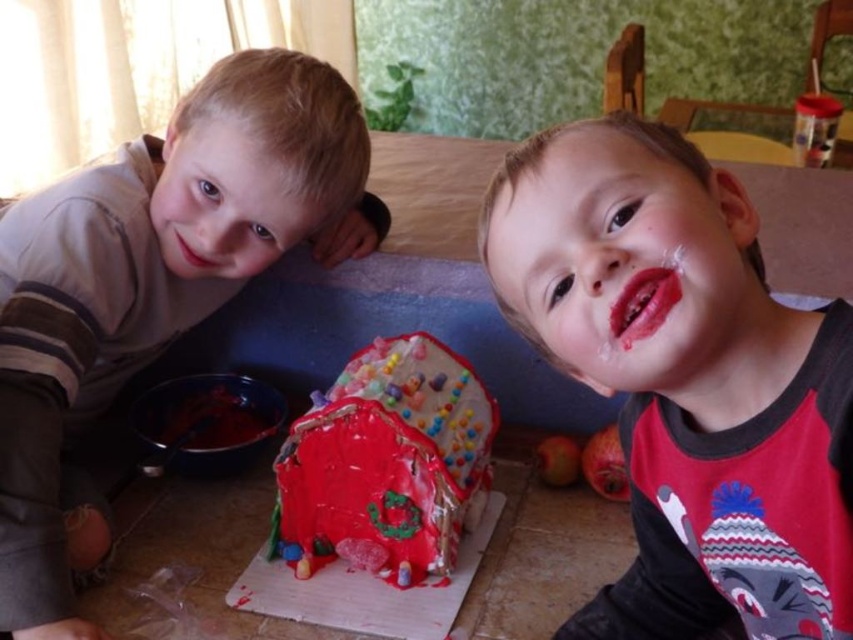
You are a photographer setting up for a family photo. You want to ensure that the matte red shirt at center and the matte gray sweater at left are both clearly visible in the shot. Based on their positions, which one should you focus on first to ensure both are in focus?

The matte red shirt at center is in front of the matte gray sweater at left, so you should focus on the matte gray sweater at left first to ensure both are in focus.

You are a child sitting at the table and want to reach both the point at coordinates point [709,369] and point [123,276]. Which point is closer to you?

Point [709,369] is in front of point [123,276], so it is closer to you.